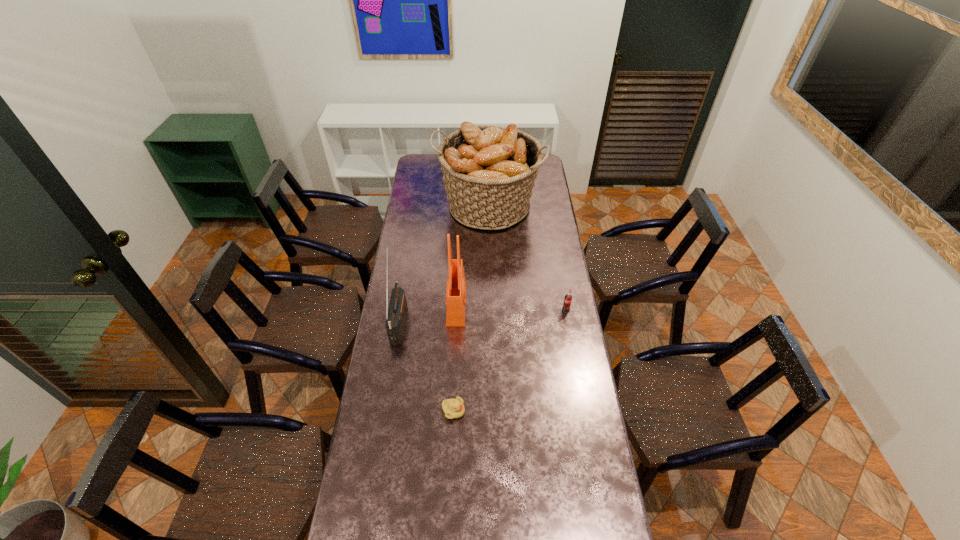
This screenshot has height=540, width=960. Identify the location of unoccupied area between the third tallest object and the nearest object. (426, 366).

Find the location of a particular element. The width and height of the screenshot is (960, 540). blank region between the farthest object and the nearest object is located at coordinates (470, 309).

Where is `empty space between the shortest object and the rightmost object`? The width and height of the screenshot is (960, 540). empty space between the shortest object and the rightmost object is located at coordinates tap(510, 361).

The width and height of the screenshot is (960, 540). I want to click on empty space between the duckling and the soda bottle, so click(510, 361).

I want to click on free space between the tote bag and the basket, so click(472, 255).

Identify the location of free spot between the soda bottle and the basket. The width and height of the screenshot is (960, 540). (527, 258).

What are the coordinates of `vacant area between the third tallest object and the duckling` in the screenshot? It's located at (426, 366).

This screenshot has width=960, height=540. In order to click on object that ranks as the fourth closest to the radio receiver in this screenshot , I will do `click(568, 298)`.

Locate which object is the closest to the radio receiver. Please provide its 2D coordinates. Your answer should be formatted as a tuple, i.e. [(x, y)], where the tuple contains the x and y coordinates of a point satisfying the conditions above.

[(456, 285)]